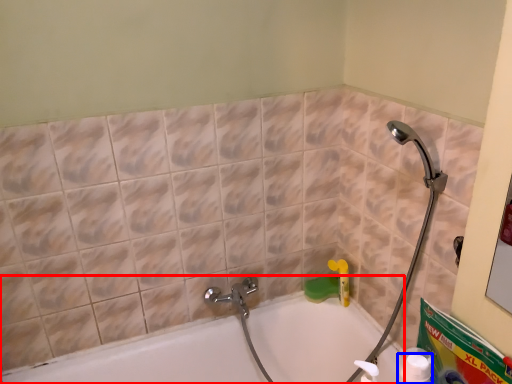
Question: Which of the following is the closest to the observer, bathtub (highlighted by a red box) or cleaning product (highlighted by a blue box)?

Choices:
 (A) bathtub
 (B) cleaning product

Answer: (B)